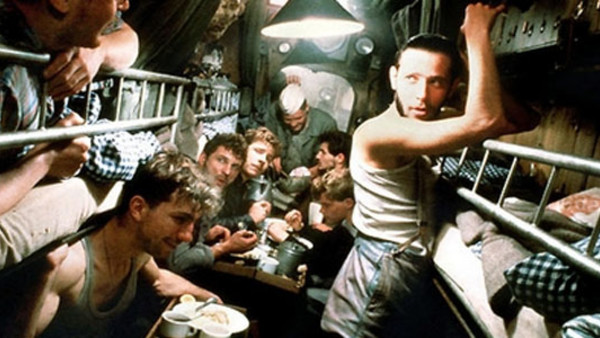
Where is `mug`? Image resolution: width=600 pixels, height=338 pixels. mug is located at coordinates (167, 326).